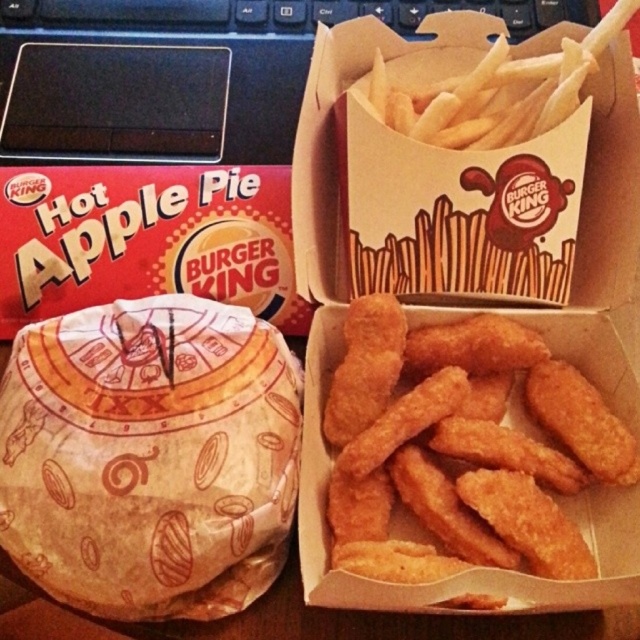
Is point (403, 492) farther from viewer compared to point (500, 141)?

No, it is not.

Looking at this image, is golden crispy nuggets at center in front of golden crispy french fries at upper center?

Yes.

Is point (442, 353) behind point (582, 44)?

No.

Identify the location of golden crispy nuggets at center. (468, 436).

From the picture: Who is higher up, golden crispy nuggets at center or black plastic laptop at upper left?

Positioned higher is black plastic laptop at upper left.

Is point (560, 381) farther from camera compared to point (122, 125)?

That is False.

At what (x,y) coordinates should I click in order to perform the action: click on golden crispy nuggets at center. Please return your answer as a coordinate pair (x, y). Image resolution: width=640 pixels, height=640 pixels. Looking at the image, I should click on (468, 436).

What do you see at coordinates (186, 72) in the screenshot?
I see `black plastic laptop at upper left` at bounding box center [186, 72].

Is black plastic laptop at upper left to the left of golden crispy french fries at upper center from the viewer's perspective?

Indeed, black plastic laptop at upper left is positioned on the left side of golden crispy french fries at upper center.

Between point (36, 83) and point (572, 88), which one is positioned behind?

The point (36, 83) is more distant.

Identify the location of black plastic laptop at upper left. The width and height of the screenshot is (640, 640). (186, 72).